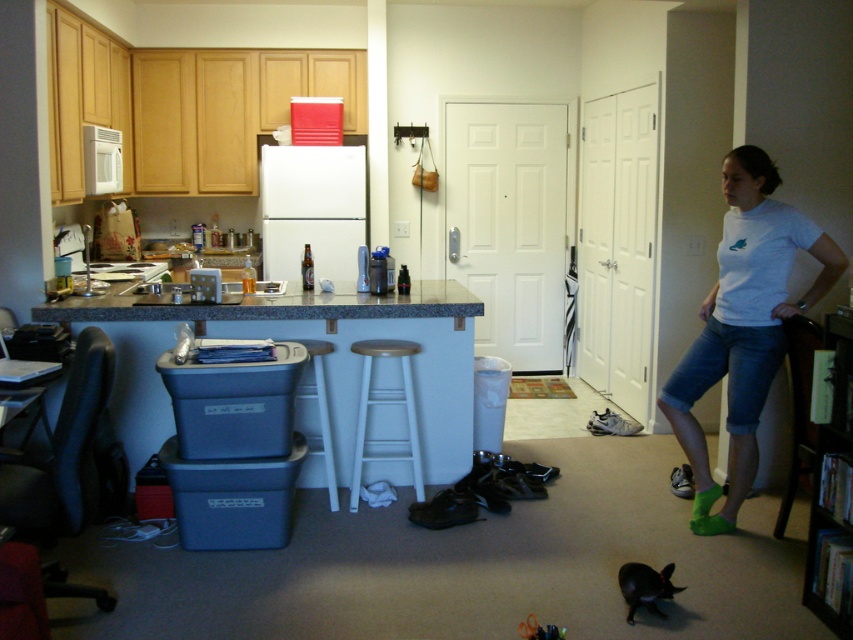
From the picture: You are trying to decide which bar stool to use in the kitchen. The white painted wood bar stool at center and the white wood bar stool at center are both available. Which one is larger?

The white painted wood bar stool at center is bigger than the white wood bar stool at center, so it is the larger one.